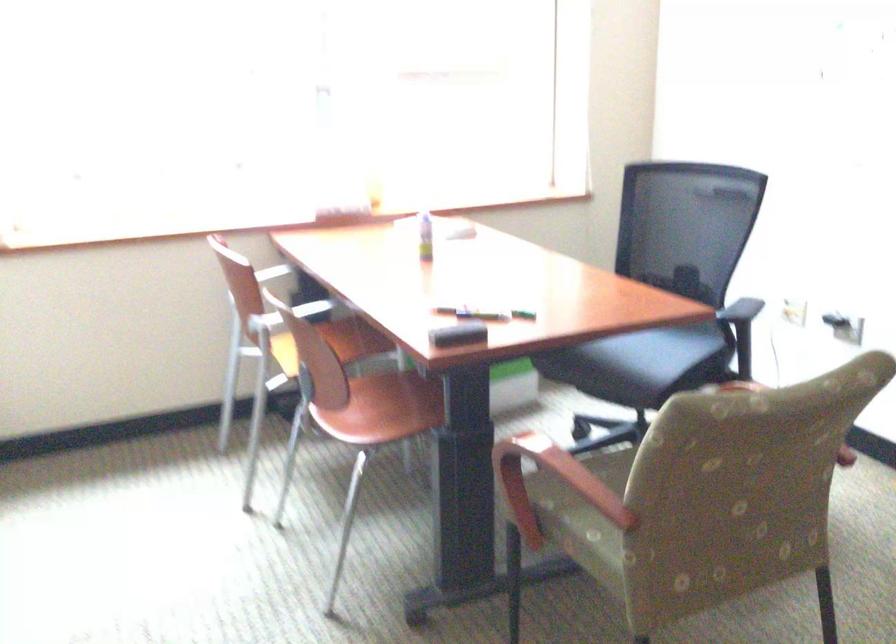
Image resolution: width=896 pixels, height=644 pixels. I want to click on black chair armrest, so click(x=739, y=308).